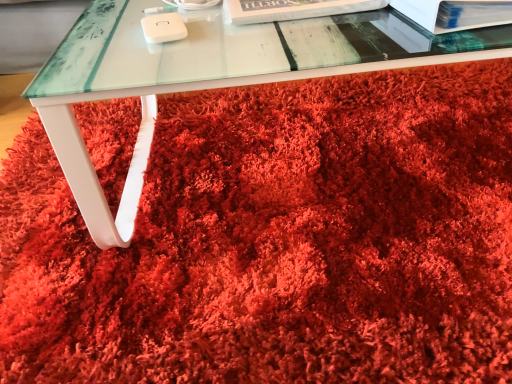
Question: Considering the positions of white glossy paperback book at upper right, acting as the 2th paperback book starting from the left, and white paper at upper center, which ranks as the first paperback book in left-to-right order, in the image, is white glossy paperback book at upper right, acting as the 2th paperback book starting from the left, wider or thinner than white paper at upper center, which ranks as the first paperback book in left-to-right order,?

Choices:
 (A) thin
 (B) wide

Answer: (B)

Question: Is point (503, 3) closer or farther from the camera than point (239, 21)?

Choices:
 (A) closer
 (B) farther

Answer: (A)

Question: Which is farther from the white glossy paperback book at upper right, acting as the first paperback book starting from the right?

Choices:
 (A) transparent glass table at center
 (B) white paper at upper center, arranged as the second paperback book when viewed from the right

Answer: (A)

Question: Considering the real-world distances, which object is farthest from the white paper at upper center, which ranks as the first paperback book in left-to-right order?

Choices:
 (A) transparent glass table at center
 (B) white glossy paperback book at upper right, acting as the first paperback book starting from the right

Answer: (A)